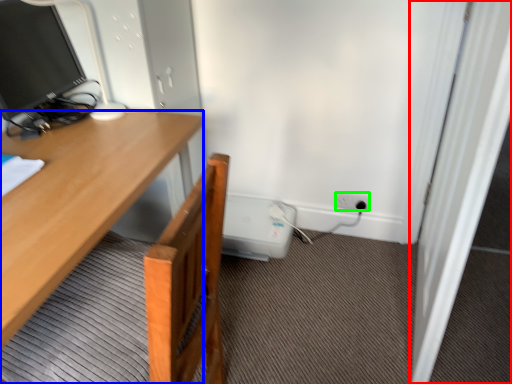
Question: Considering the real-world distances, which object is closest to screen door (highlighted by a red box)? desk (highlighted by a blue box) or power outlet (highlighted by a green box).

Choices:
 (A) desk
 (B) power outlet

Answer: (B)